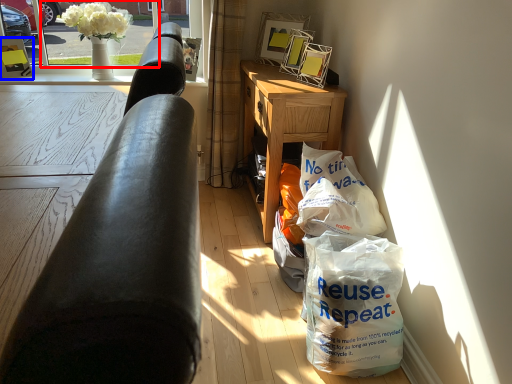
Question: Which object is further to the camera taking this photo, window screen (highlighted by a red box) or picture frame (highlighted by a blue box)?

Choices:
 (A) window screen
 (B) picture frame

Answer: (B)